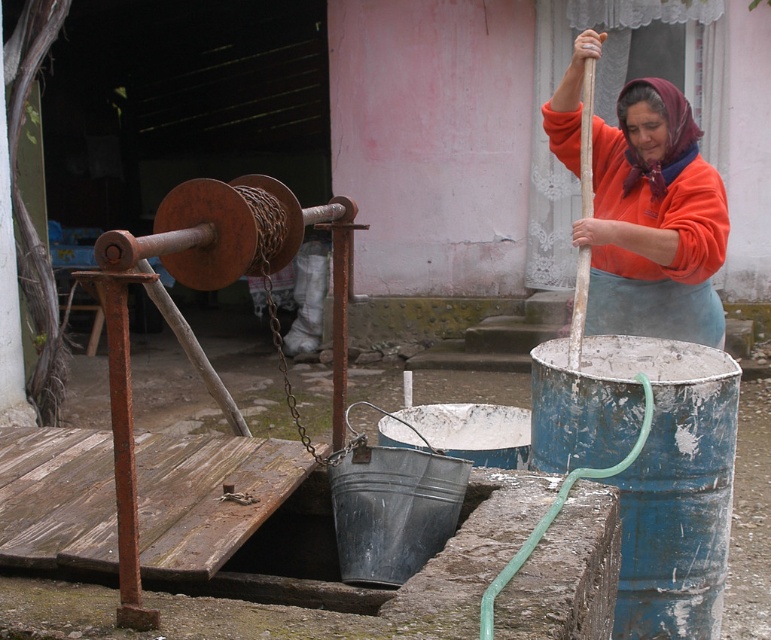
Between blue metallic barrel at lower right and orange fleece at center, which one is positioned higher?

orange fleece at center is higher up.

Who is lower down, blue metallic barrel at lower right or orange fleece at center?

blue metallic barrel at lower right

Does point (695, 538) come farther from viewer compared to point (682, 332)?

That is False.

You are a GUI agent. You are given a task and a screenshot of the screen. Output one action in this format:
    pyautogui.click(x=<x>, y=<y>)
    Task: Click on the blue metallic barrel at lower right
    This screenshot has width=771, height=640.
    Given the screenshot: What is the action you would take?
    pyautogui.click(x=648, y=467)